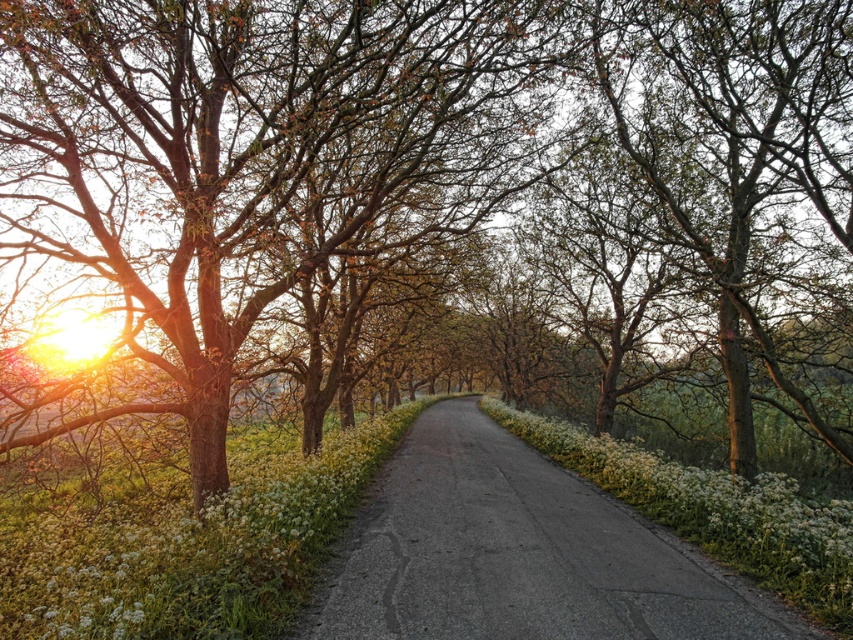
Can you confirm if asphalt road at center is positioned above white matte flower at center-left?

Yes.

Can you confirm if asphalt road at center is positioned to the left of white matte flower at center-left?

Incorrect, asphalt road at center is not on the left side of white matte flower at center-left.

Where is `asphalt road at center`? asphalt road at center is located at coordinates (519, 554).

Where is `asphalt road at center`? The width and height of the screenshot is (853, 640). asphalt road at center is located at coordinates (519, 554).

Between point (282, 285) and point (300, 584), which one is positioned in front?

Point (300, 584) is more forward.

Between point (45, 296) and point (262, 493), which one is positioned behind?

Positioned behind is point (45, 296).

Is point (256, 292) farther from viewer compared to point (0, 522)?

No.

Locate an element on the screen. brown textured tree at left is located at coordinates (242, 172).

Does brown textured tree at left have a greater height compared to asphalt road at center?

Indeed, brown textured tree at left has a greater height compared to asphalt road at center.

Is brown textured tree at left further to camera compared to asphalt road at center?

Yes.

Locate an element on the screen. Image resolution: width=853 pixels, height=640 pixels. brown textured tree at left is located at coordinates (242, 172).